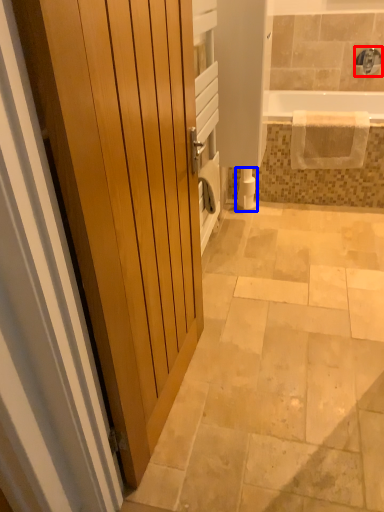
Question: Which object appears closest to the camera in this image, faucet (highlighted by a red box) or toilet paper (highlighted by a blue box)?

Choices:
 (A) faucet
 (B) toilet paper

Answer: (B)